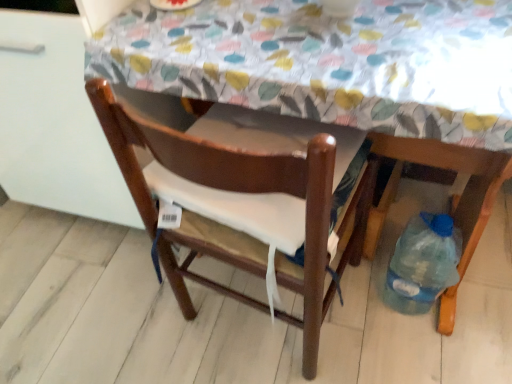
This screenshot has width=512, height=384. What are the coordinates of `wooden table at center` in the screenshot? It's located at (342, 75).

Image resolution: width=512 pixels, height=384 pixels. What are the coordinates of `wooden table at center` in the screenshot? It's located at (342, 75).

Is brown wooden chair at center, which is the second chair in right-to-left order, placed right next to translucent plastic bottle at lower right, which appears as the 2th chair when viewed from the left?

There is a gap between brown wooden chair at center, which is the second chair in right-to-left order, and translucent plastic bottle at lower right, which appears as the 2th chair when viewed from the left.

Would you say brown wooden chair at center, which is the 1th chair from left to right, is outside translucent plastic bottle at lower right, which ranks as the first chair in right-to-left order?

Absolutely, brown wooden chair at center, which is the 1th chair from left to right, is external to translucent plastic bottle at lower right, which ranks as the first chair in right-to-left order.

Can you confirm if brown wooden chair at center, which is the second chair in right-to-left order, is bigger than translucent plastic bottle at lower right, which appears as the 2th chair when viewed from the left?

Indeed, brown wooden chair at center, which is the second chair in right-to-left order, has a larger size compared to translucent plastic bottle at lower right, which appears as the 2th chair when viewed from the left.

Between brown wooden chair at center, which is the second chair in right-to-left order, and translucent plastic bottle at lower right, which ranks as the first chair in right-to-left order, which one has less height?

Standing shorter between the two is brown wooden chair at center, which is the second chair in right-to-left order.

Can you see translucent plastic bottle at lower right, which appears as the 2th chair when viewed from the left, touching brown wooden chair at center, which is the 1th chair from left to right?

No, translucent plastic bottle at lower right, which appears as the 2th chair when viewed from the left, is not beside brown wooden chair at center, which is the 1th chair from left to right.

How distant is translucent plastic bottle at lower right, which appears as the 2th chair when viewed from the left, from brown wooden chair at center, which is the 1th chair from left to right?

A distance of 14.43 inches exists between translucent plastic bottle at lower right, which appears as the 2th chair when viewed from the left, and brown wooden chair at center, which is the 1th chair from left to right.

Which point is more forward, [502,180] or [159,124]?

Positioned in front is point [159,124].

From a real-world perspective, who is located higher, translucent plastic bottle at lower right, which ranks as the first chair in right-to-left order, or brown wooden chair at center, which is the 1th chair from left to right?

In real-world perspective, translucent plastic bottle at lower right, which ranks as the first chair in right-to-left order, is above.

From a real-world perspective, is translucent plastic bottle at lower right, which appears as the 2th chair when viewed from the left, positioned over wooden table at center based on gravity?

No, from a real-world perspective, translucent plastic bottle at lower right, which appears as the 2th chair when viewed from the left, is not over wooden table at center

Based on the photo, what's the angular difference between translucent plastic bottle at lower right, which ranks as the first chair in right-to-left order, and wooden table at center's facing directions?

translucent plastic bottle at lower right, which ranks as the first chair in right-to-left order, and wooden table at center are facing 174 degrees away from each other.

Considering the sizes of translucent plastic bottle at lower right, which ranks as the first chair in right-to-left order, and wooden table at center in the image, is translucent plastic bottle at lower right, which ranks as the first chair in right-to-left order, wider or thinner than wooden table at center?

In the image, translucent plastic bottle at lower right, which ranks as the first chair in right-to-left order, appears to be more narrow than wooden table at center.

How much distance is there between translucent plastic bottle at lower right, which appears as the 2th chair when viewed from the left, and wooden table at center?

The distance of translucent plastic bottle at lower right, which appears as the 2th chair when viewed from the left, from wooden table at center is 16.60 inches.

Looking at this image, considering the positions of objects brown wooden chair at center, which is the 1th chair from left to right, and wooden table at center in the image provided, who is more to the left, brown wooden chair at center, which is the 1th chair from left to right, or wooden table at center?

brown wooden chair at center, which is the 1th chair from left to right.

Does brown wooden chair at center, which is the 1th chair from left to right, lie behind wooden table at center?

Yes, it is behind wooden table at center.

At what (x,y) coordinates should I click in order to perform the action: click on table located on the right of brown wooden chair at center, which is the second chair in right-to-left order. Please return your answer as a coordinate pair (x, y). Image resolution: width=512 pixels, height=384 pixels. Looking at the image, I should click on (342, 75).

In terms of height, does brown wooden chair at center, which is the second chair in right-to-left order, look taller or shorter compared to wooden table at center?

Considering their sizes, brown wooden chair at center, which is the second chair in right-to-left order, has less height than wooden table at center.

From a real-world perspective, between wooden table at center and brown wooden chair at center, which is the second chair in right-to-left order, who is vertically lower?

brown wooden chair at center, which is the second chair in right-to-left order.

Is wooden table at center bigger than brown wooden chair at center, which is the 1th chair from left to right?

Indeed, wooden table at center has a larger size compared to brown wooden chair at center, which is the 1th chair from left to right.

From the image's perspective, which one is positioned lower, wooden table at center or brown wooden chair at center, which is the second chair in right-to-left order?

From the image's view, brown wooden chair at center, which is the second chair in right-to-left order, is below.

Is wooden table at center oriented towards translucent plastic bottle at lower right, which appears as the 2th chair when viewed from the left?

No.

From a real-world perspective, which object stands above the other?

In real-world perspective, wooden table at center is above.

Is wooden table at center bigger or smaller than translucent plastic bottle at lower right, which appears as the 2th chair when viewed from the left?

Considering their sizes, wooden table at center takes up more space than translucent plastic bottle at lower right, which appears as the 2th chair when viewed from the left.

Find the location of `chair that appears on the right of brown wooden chair at center, which is the second chair in right-to-left order`. chair that appears on the right of brown wooden chair at center, which is the second chair in right-to-left order is located at coordinates (444, 169).

Locate an element on the screen. chair on the left of the translucent plastic bottle at lower right, which ranks as the first chair in right-to-left order is located at coordinates (234, 191).

Which object lies further to the anchor point brown wooden chair at center, which is the second chair in right-to-left order, translucent plastic bottle at lower right, which ranks as the first chair in right-to-left order, or wooden table at center?

translucent plastic bottle at lower right, which ranks as the first chair in right-to-left order, is further to brown wooden chair at center, which is the second chair in right-to-left order.

Considering their positions, is wooden table at center positioned further to brown wooden chair at center, which is the second chair in right-to-left order, than translucent plastic bottle at lower right, which appears as the 2th chair when viewed from the left?

translucent plastic bottle at lower right, which appears as the 2th chair when viewed from the left, is further to brown wooden chair at center, which is the second chair in right-to-left order.

Considering their positions, is translucent plastic bottle at lower right, which ranks as the first chair in right-to-left order, positioned further to wooden table at center than brown wooden chair at center, which is the second chair in right-to-left order?

The object further to wooden table at center is translucent plastic bottle at lower right, which ranks as the first chair in right-to-left order.

Which object lies nearer to the anchor point wooden table at center, brown wooden chair at center, which is the second chair in right-to-left order, or translucent plastic bottle at lower right, which ranks as the first chair in right-to-left order?

brown wooden chair at center, which is the second chair in right-to-left order, is positioned closer to the anchor wooden table at center.

When comparing their distances from translucent plastic bottle at lower right, which ranks as the first chair in right-to-left order, does wooden table at center or brown wooden chair at center, which is the 1th chair from left to right, seem closer?

brown wooden chair at center, which is the 1th chair from left to right.

Estimate the real-world distances between objects in this image. Which object is closer to translucent plastic bottle at lower right, which ranks as the first chair in right-to-left order, brown wooden chair at center, which is the 1th chair from left to right, or wooden table at center?

brown wooden chair at center, which is the 1th chair from left to right, is closer to translucent plastic bottle at lower right, which ranks as the first chair in right-to-left order.

Find the location of a particular element. The image size is (512, 384). table between brown wooden chair at center, which is the 1th chair from left to right, and translucent plastic bottle at lower right, which ranks as the first chair in right-to-left order, in the horizontal direction is located at coordinates (342, 75).